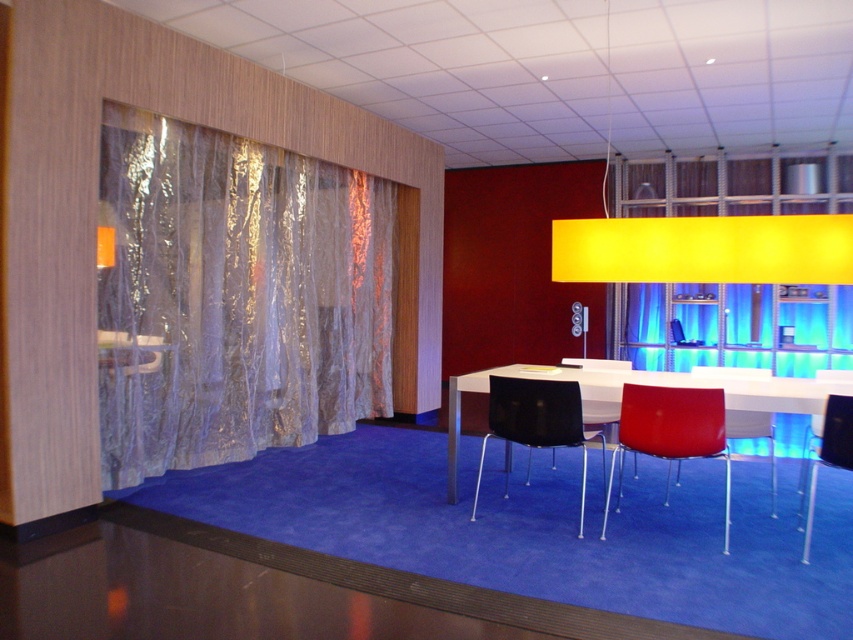
You are organizing a small event in this room and need to place a 2.5 meter long banner between the white glossy table at center and the black plastic chair at center. Is there enough space between them to accommodate the banner?

The white glossy table at center is larger than the black plastic chair at center, but the exact distance between them isn

You are a maintenance worker needing to inspect the translucent metallic curtain at left and the matte red chair at center. If your inspection tool has a maximum reach of 3 meters, can you reach both objects from your current position without moving closer?

The distance between the translucent metallic curtain at left and the matte red chair at center is 3.15 meters. Since the tool can only reach 3 meters, you cannot reach both objects without moving closer.

You are standing at the entrance of the room and want to place a new plant in the exact center of the white glossy table at center. Given that the room has a coordinate system where the bottom left corner is the origin, can you determine the coordinates where you should place the plant?

The white glossy table at center is located at coordinates point (648,385), so placing the plant at those coordinates would position it exactly at the center of the table.